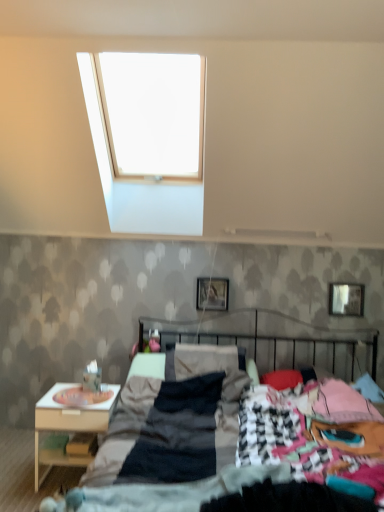
Question: Is dark gray fabric bed at center far from white wood nightstand at lower left?

Choices:
 (A) no
 (B) yes

Answer: (A)

Question: Does dark gray fabric bed at center have a larger size compared to white wood nightstand at lower left?

Choices:
 (A) yes
 (B) no

Answer: (A)

Question: From the image's perspective, is dark gray fabric bed at center located above white wood nightstand at lower left?

Choices:
 (A) no
 (B) yes

Answer: (B)

Question: From a real-world perspective, is dark gray fabric bed at center beneath white wood nightstand at lower left?

Choices:
 (A) no
 (B) yes

Answer: (A)

Question: Does dark gray fabric bed at center touch white wood nightstand at lower left?

Choices:
 (A) no
 (B) yes

Answer: (A)

Question: From the image's perspective, relative to metallic silver picture frame at center, which is the first picture frame from left to right, is white wood nightstand at lower left above or below?

Choices:
 (A) above
 (B) below

Answer: (B)

Question: Is white wood nightstand at lower left to the left or to the right of metallic silver picture frame at center, which ranks as the 2th picture frame in right-to-left order, in the image?

Choices:
 (A) right
 (B) left

Answer: (B)

Question: From a real-world perspective, relative to metallic silver picture frame at center, which is the first picture frame from left to right, is white wood nightstand at lower left vertically above or below?

Choices:
 (A) above
 (B) below

Answer: (B)

Question: Is point (69, 389) positioned closer to the camera than point (221, 304)?

Choices:
 (A) farther
 (B) closer

Answer: (B)

Question: Is point (168, 359) positioned closer to the camera than point (49, 414)?

Choices:
 (A) farther
 (B) closer

Answer: (A)

Question: From the image's perspective, is dark gray fabric bed at center positioned above or below white wood nightstand at lower left?

Choices:
 (A) above
 (B) below

Answer: (A)

Question: Considering their positions, is dark gray fabric bed at center located in front of or behind white wood nightstand at lower left?

Choices:
 (A) front
 (B) behind

Answer: (A)

Question: Is dark gray fabric bed at center bigger or smaller than white wood nightstand at lower left?

Choices:
 (A) big
 (B) small

Answer: (A)

Question: From the image's perspective, is metallic silver picture frame at upper right, the 1th picture frame viewed from the right, located above or below white wood nightstand at lower left?

Choices:
 (A) below
 (B) above

Answer: (B)

Question: Is metallic silver picture frame at upper right, which is the second picture frame in left-to-right order, to the left or to the right of white wood nightstand at lower left in the image?

Choices:
 (A) right
 (B) left

Answer: (A)